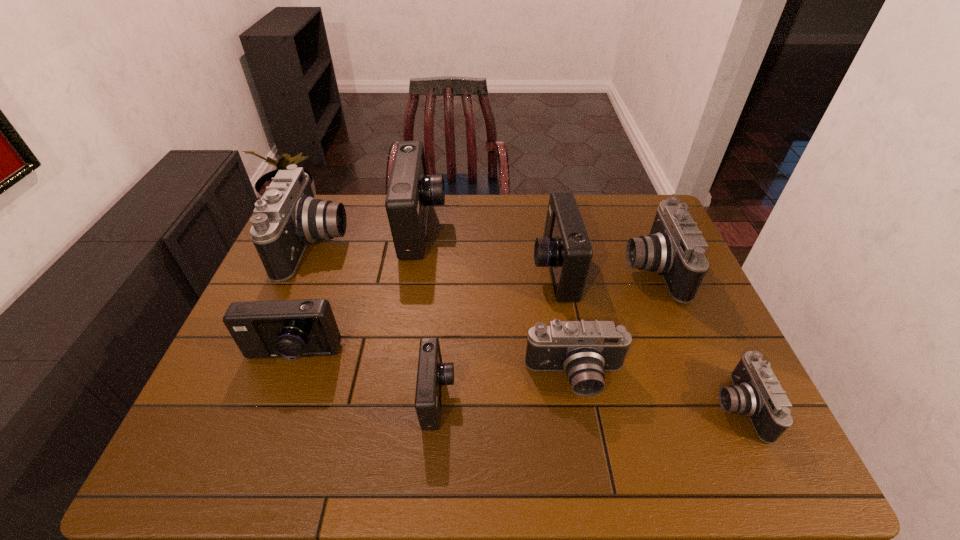
Locate an element on the screen. The height and width of the screenshot is (540, 960). free space located 0.050m on the front-facing side of the rightmost blue camera is located at coordinates (516, 271).

You are a GUI agent. You are given a task and a screenshot of the screen. Output one action in this format:
    pyautogui.click(x=<x>, y=<y>)
    Task: Click on the free spot located 0.150m on the front-facing side of the rightmost blue camera
    This screenshot has height=540, width=960.
    Given the screenshot: What is the action you would take?
    pyautogui.click(x=482, y=271)

Identify the location of vacant space located 0.380m on the front-facing side of the rightmost blue camera. Image resolution: width=960 pixels, height=540 pixels. (406, 271).

Identify the location of vacant space located 0.380m on the front-facing side of the second biggest black camera. (499, 269).

Where is `vacant space located on the front-facing side of the second biggest black camera`? The width and height of the screenshot is (960, 540). vacant space located on the front-facing side of the second biggest black camera is located at coordinates point(571,269).

Identify the location of vacant area situated 0.080m on the front-facing side of the second biggest black camera. (598, 269).

What are the coordinates of `free space located 0.130m on the front-facing side of the third biggest blue camera` in the screenshot? It's located at (267, 422).

Where is `vacant space located on the front-facing side of the second smallest black camera`? This screenshot has height=540, width=960. vacant space located on the front-facing side of the second smallest black camera is located at coordinates (584, 423).

Where is `vacant space located 0.190m on the front-facing side of the smallest blue camera`? vacant space located 0.190m on the front-facing side of the smallest blue camera is located at coordinates (537, 397).

At what (x,y) coordinates should I click in order to perform the action: click on vacant space positioned 0.100m on the front-facing side of the smallest black camera. Please return your answer as a coordinate pair (x, y). The image size is (960, 540). Looking at the image, I should click on (672, 407).